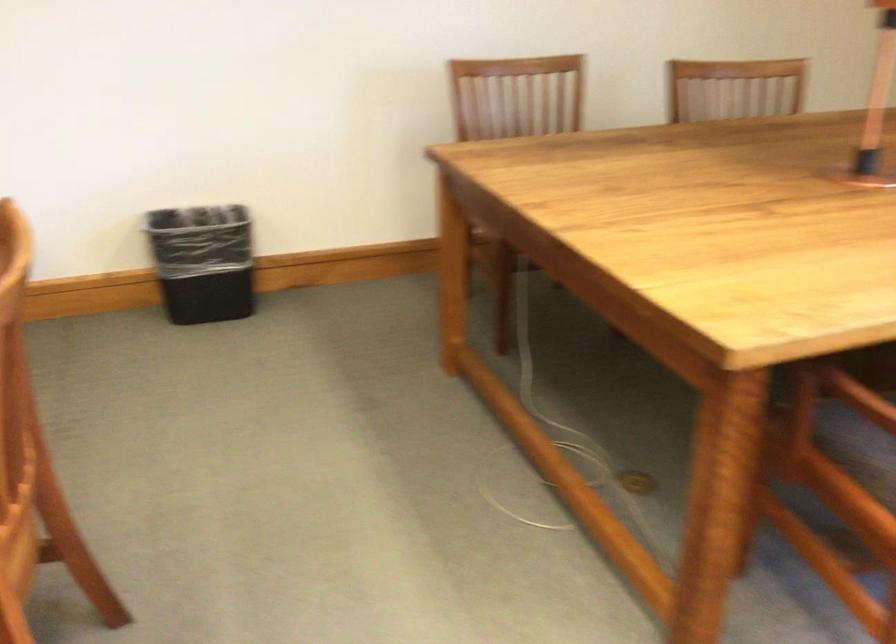
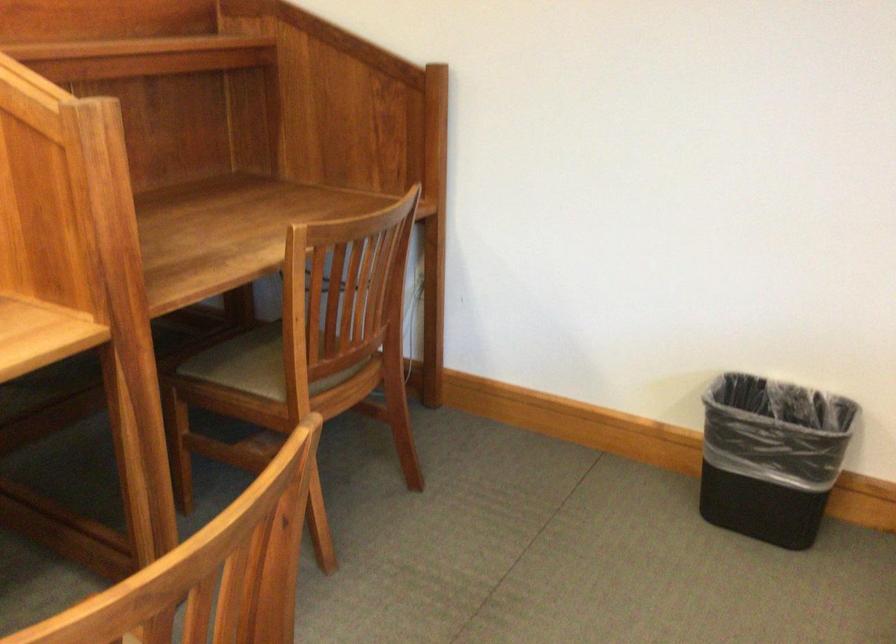
The point at (x=207, y=258) is marked in the first image. Where is the corresponding point in the second image?

(771, 456)